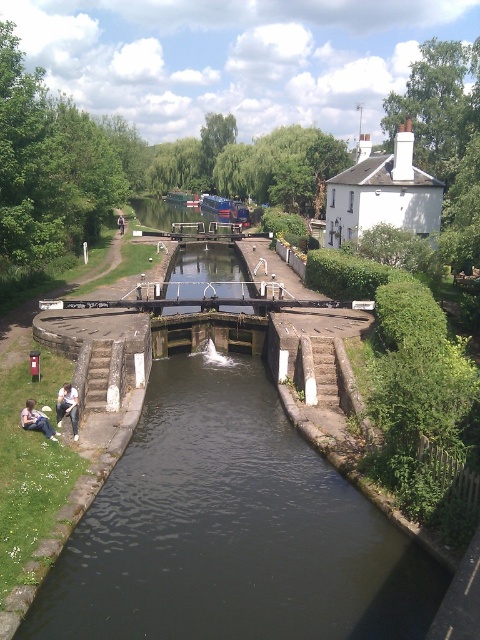
Question: Can you confirm if dark stone water at center is positioned to the right of light blue jeans at lower left?

Choices:
 (A) no
 (B) yes

Answer: (B)

Question: Which object appears closest to the camera in this image?

Choices:
 (A) smooth concrete lock gate at center
 (B) dark stone water at center
 (C) light blue jeans at lower left

Answer: (B)

Question: Which object is closer to the camera taking this photo?

Choices:
 (A) light blue jeans at lower left
 (B) light brown wooden bench at lower left
 (C) smooth concrete lock gate at center

Answer: (A)

Question: Which point is closer to the camera?

Choices:
 (A) dark stone water at center
 (B) light brown wooden bench at lower left
 (C) light blue jeans at lower left
 (D) smooth concrete lock gate at center

Answer: (A)

Question: From the image, what is the correct spatial relationship of smooth concrete lock gate at center in relation to light blue jeans at lower left?

Choices:
 (A) above
 (B) below

Answer: (A)

Question: Does smooth concrete lock gate at center have a smaller size compared to light brown wooden bench at lower left?

Choices:
 (A) no
 (B) yes

Answer: (A)